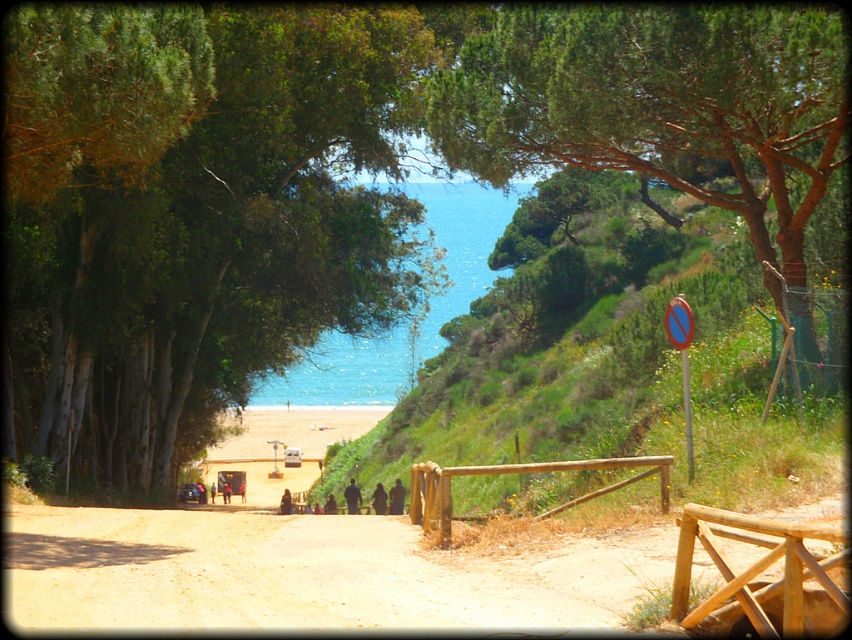
You are planning to build a small garden on the green grassy hillside at center. Considering the position of the blue water at center, what should you be cautious about regarding water drainage?

The green grassy hillside at center is below the blue water at center, so you should be cautious about potential water runoff from the higher blue water area affecting the garden.

You are planning to build a small garden on the green grassy hillside at center and the blue water at center. Based on their heights, which location would be more suitable for a garden that requires flat and elevated terrain?

The green grassy hillside at center has a lesser height compared to blue water at center, so the blue water at center would be more suitable for a garden that requires flat and elevated terrain.

You are a hiker standing on the dirt path and want to take a photo of the blue water at center. However, you notice the green leafy tree at upper right is blocking your view. Is the tree between you and the water?

Yes, the green leafy tree at upper right is in front of the blue water at center, so it is blocking your view.